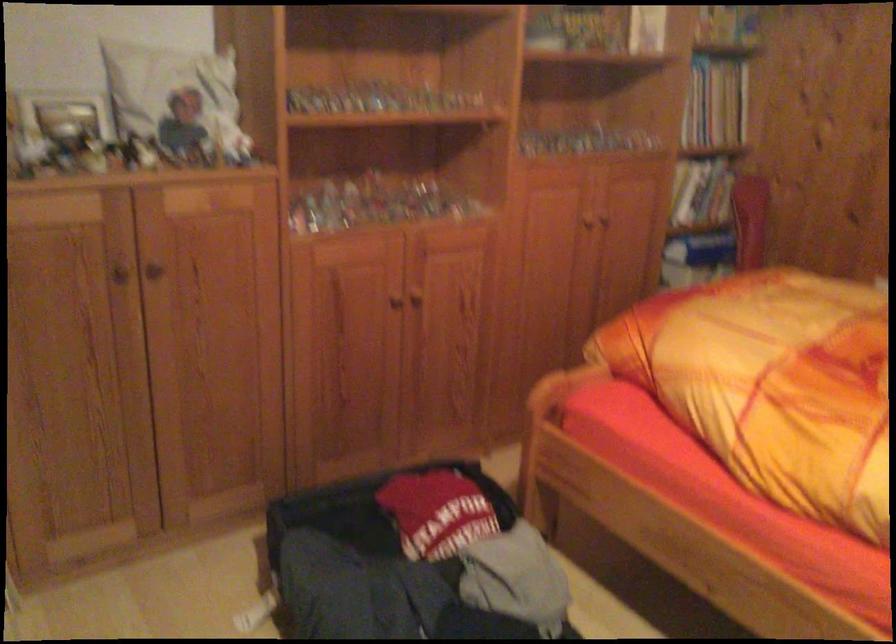
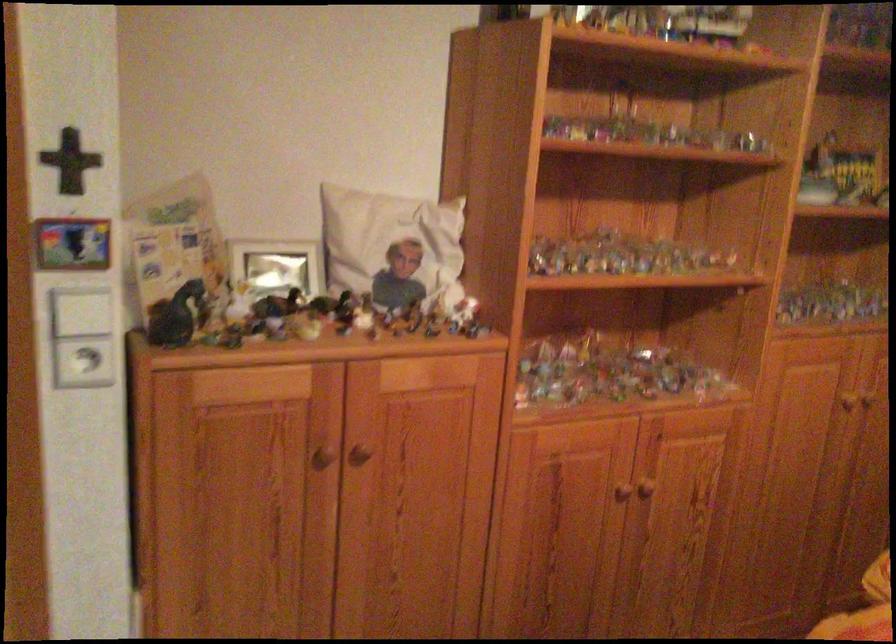
Question: The images are taken continuously from a first-person perspective. In which direction is your viewpoint rotating?

Choices:
 (A) Left
 (B) Right
 (C) Up
 (D) Down

Answer: (A)